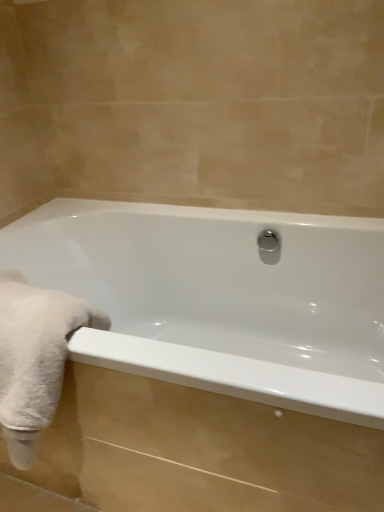
Question: From the image's perspective, does white fluffy towel at left appear lower than polished chrome shower at center?

Choices:
 (A) no
 (B) yes

Answer: (B)

Question: From a real-world perspective, is white fluffy towel at left located beneath polished chrome shower at center?

Choices:
 (A) yes
 (B) no

Answer: (A)

Question: Is white fluffy towel at left facing away from polished chrome shower at center?

Choices:
 (A) yes
 (B) no

Answer: (B)

Question: Is white fluffy towel at left next to polished chrome shower at center and touching it?

Choices:
 (A) no
 (B) yes

Answer: (A)

Question: Can you confirm if white fluffy towel at left is bigger than polished chrome shower at center?

Choices:
 (A) no
 (B) yes

Answer: (B)

Question: Could you tell me if white fluffy towel at left is facing polished chrome shower at center?

Choices:
 (A) yes
 (B) no

Answer: (B)

Question: From the image's perspective, would you say polished chrome shower at center is positioned over white fluffy towel at left?

Choices:
 (A) no
 (B) yes

Answer: (B)

Question: Does polished chrome shower at center have a lesser width compared to white fluffy towel at left?

Choices:
 (A) no
 (B) yes

Answer: (B)

Question: Considering the relative positions of polished chrome shower at center and white fluffy towel at left in the image provided, is polished chrome shower at center to the right of white fluffy towel at left from the viewer's perspective?

Choices:
 (A) yes
 (B) no

Answer: (A)

Question: Are polished chrome shower at center and white fluffy towel at left far apart?

Choices:
 (A) yes
 (B) no

Answer: (B)

Question: Is polished chrome shower at center behind white fluffy towel at left?

Choices:
 (A) yes
 (B) no

Answer: (A)

Question: Is polished chrome shower at center oriented towards white fluffy towel at left?

Choices:
 (A) yes
 (B) no

Answer: (B)

Question: Would you say white fluffy towel at left is outside white glossy bathtub at center?

Choices:
 (A) no
 (B) yes

Answer: (A)